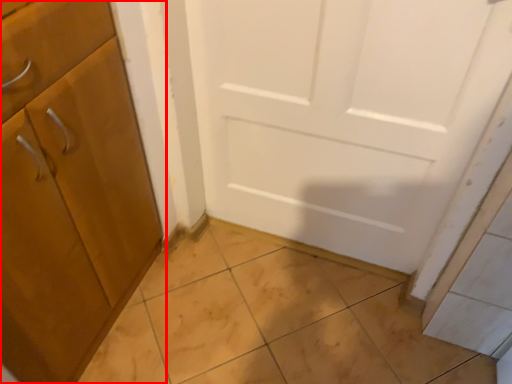
Question: From the image's perspective, where is cabinetry (annotated by the red box) located relative to tile?

Choices:
 (A) above
 (B) below

Answer: (A)